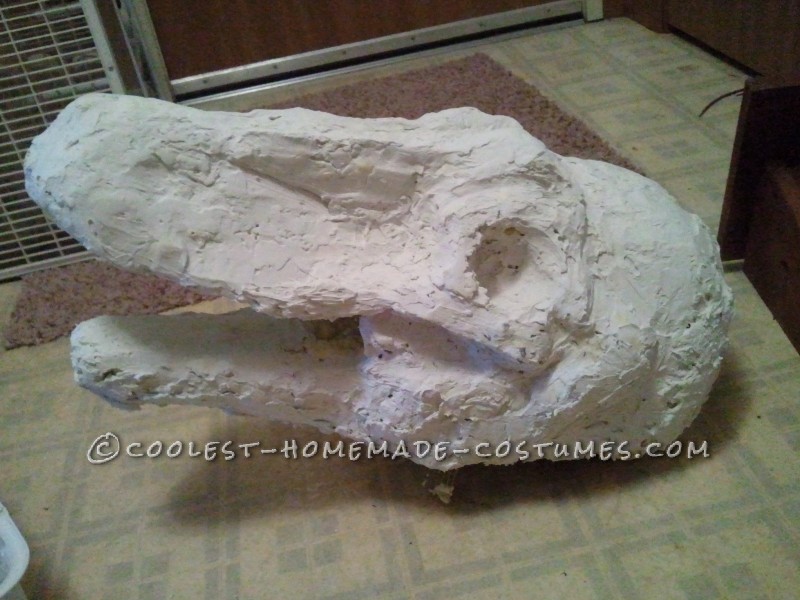
This screenshot has height=600, width=800. In order to click on door in this screenshot , I will do `click(222, 35)`.